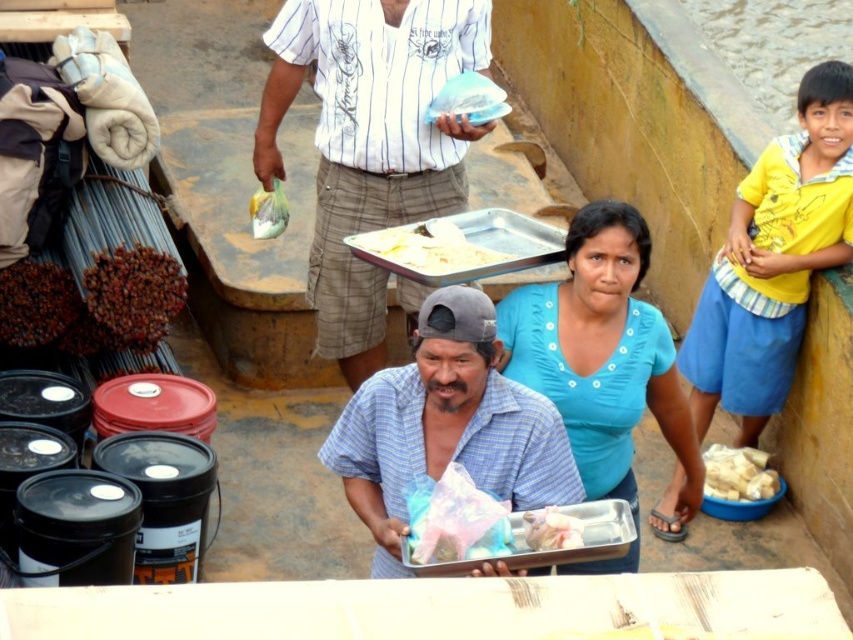
Between white striped shirt at center and blue plaid shirt at center, which one is positioned higher?

white striped shirt at center is above.

Which is behind, point (323, 125) or point (366, 384)?

The point (323, 125) is behind.

This screenshot has width=853, height=640. I want to click on white striped shirt at center, so click(370, 141).

Is white plastic bag at lower right to the left of white plastic bag at upper center from the viewer's perspective?

In fact, white plastic bag at lower right is to the right of white plastic bag at upper center.

Which is more to the right, white plastic bag at lower right or white plastic bag at upper center?

From the viewer's perspective, white plastic bag at lower right appears more on the right side.

Image resolution: width=853 pixels, height=640 pixels. Identify the location of white plastic bag at lower right. (738, 474).

Which is above, blue plaid shirt at center or blue cotton shirt at center?

blue cotton shirt at center

Does point (416, 444) come closer to viewer compared to point (643, 260)?

That is True.

Is point (556, 468) in front of point (660, 410)?

Yes, it is in front of point (660, 410).

I want to click on blue plaid shirt at center, so [447, 426].